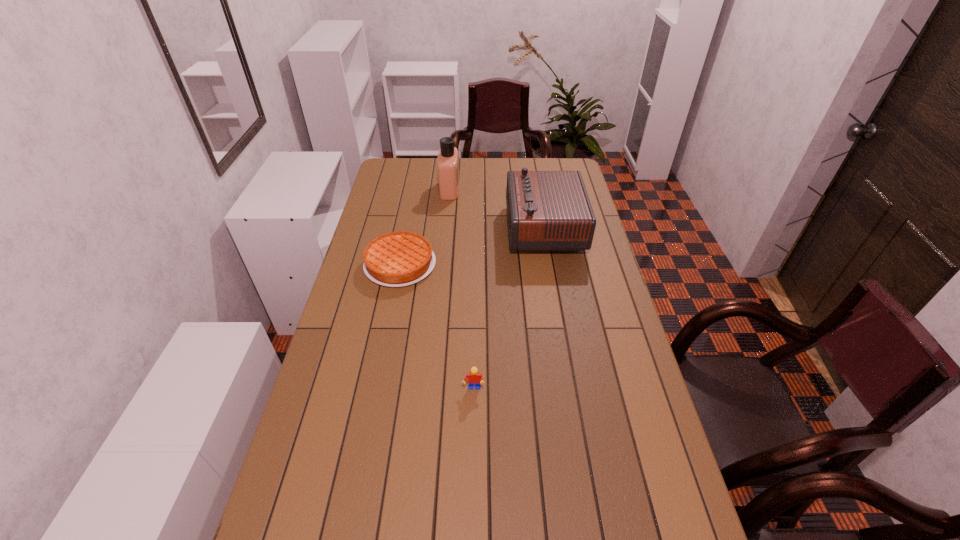
Where is `the farthest object`? The width and height of the screenshot is (960, 540). the farthest object is located at coordinates (447, 162).

The image size is (960, 540). Find the location of `perfume`. perfume is located at coordinates (447, 162).

Identify the location of the third shortest object. (547, 210).

This screenshot has height=540, width=960. What are the coordinates of `the rightmost object` in the screenshot? It's located at (547, 210).

The width and height of the screenshot is (960, 540). I want to click on the nearest object, so click(474, 377).

This screenshot has height=540, width=960. I want to click on the second object from right to left, so click(474, 377).

Locate an element on the screen. the shortest object is located at coordinates (397, 259).

At what (x,y) coordinates should I click in order to perform the action: click on free location located 0.210m on the front label of the farthest object. Please return your answer as a coordinate pair (x, y). Looking at the image, I should click on (507, 190).

Locate an element on the screen. The height and width of the screenshot is (540, 960). blank space located 0.320m on the front panel of the radio receiver is located at coordinates [426, 228].

The width and height of the screenshot is (960, 540). I want to click on vacant space located on the front panel of the radio receiver, so click(423, 228).